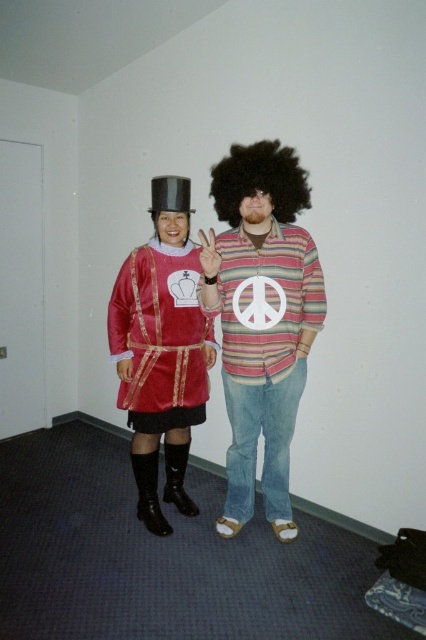
Question: Is striped cotton shirt at center smaller than afro at center?

Choices:
 (A) yes
 (B) no

Answer: (B)

Question: Which point appears farthest from the camera in this image?

Choices:
 (A) (281, 168)
 (B) (146, 307)

Answer: (B)

Question: Can you confirm if striped cotton shirt at center is bigger than afro at center?

Choices:
 (A) yes
 (B) no

Answer: (A)

Question: Which point is closer to the camera?

Choices:
 (A) afro at center
 (B) striped cotton shirt at center
 (C) velvet red dress at left

Answer: (B)

Question: Which object appears farthest from the camera in this image?

Choices:
 (A) afro at center
 (B) striped cotton shirt at center
 (C) velvet red dress at left

Answer: (C)

Question: Does striped cotton shirt at center have a larger size compared to afro at center?

Choices:
 (A) no
 (B) yes

Answer: (B)